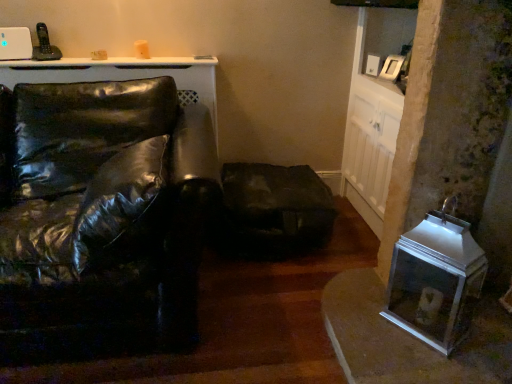
Question: From a real-world perspective, is dark brown leather swivel chair at center positioned above or below glossy black leather couch at left?

Choices:
 (A) below
 (B) above

Answer: (A)

Question: In the image, is dark brown leather swivel chair at center positioned in front of or behind glossy black leather couch at left?

Choices:
 (A) behind
 (B) front

Answer: (A)

Question: Estimate the real-world distances between objects in this image. Which object is farther from the glossy black leather couch at left?

Choices:
 (A) dark brown leather swivel chair at center
 (B) metallic silver pet carrier at lower right

Answer: (B)

Question: Which object is the closest to the dark brown leather swivel chair at center?

Choices:
 (A) glossy black leather couch at left
 (B) metallic silver pet carrier at lower right

Answer: (B)